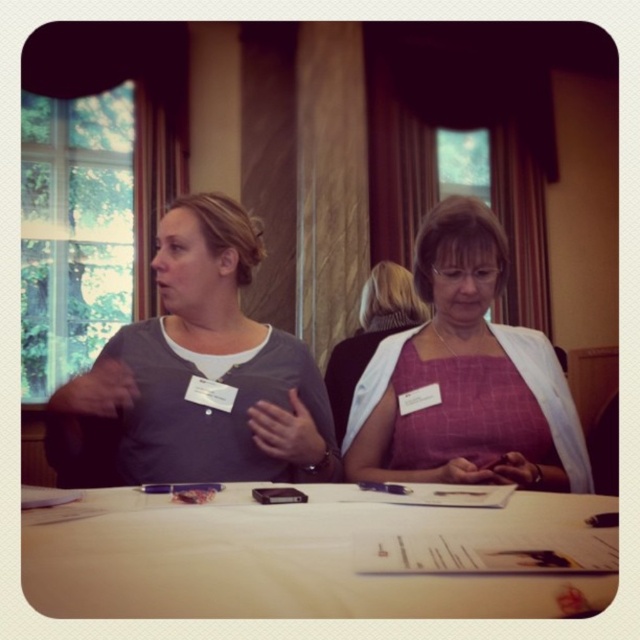
Describe the element at coordinates (276, 557) in the screenshot. Image resolution: width=640 pixels, height=640 pixels. I see `white cloth at center` at that location.

Does white cloth at center appear under pink fabric dress at center?

Yes.

Locate an element on the screen. This screenshot has width=640, height=640. white cloth at center is located at coordinates (276, 557).

In order to click on white cloth at center in this screenshot , I will do `click(276, 557)`.

Who is lower down, gray matte shirt at center or pink fabric dress at center?

pink fabric dress at center is lower down.

Identify the location of gray matte shirt at center. This screenshot has width=640, height=640. (198, 372).

Identify the location of gray matte shirt at center. This screenshot has height=640, width=640. 198,372.

Can you confirm if white cloth at center is smaller than gray matte shirt at center?

Yes.

Does white cloth at center appear over gray matte shirt at center?

Actually, white cloth at center is below gray matte shirt at center.

Who is more distant from viewer, (230, 508) or (212, 212)?

Point (212, 212)

Identify the location of white cloth at center. (276, 557).